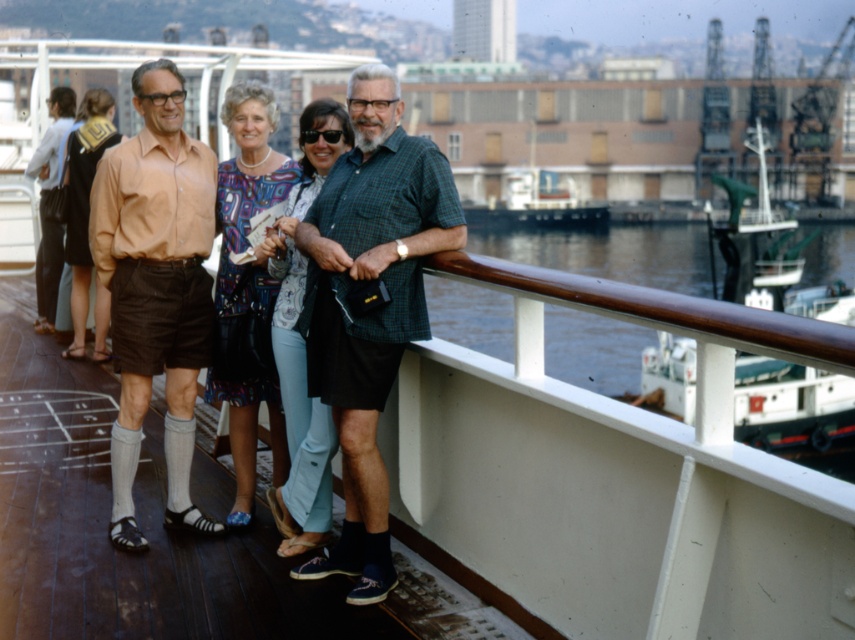
You are a photographer standing on the deck of a ship, and you want to take a photo of both the matte peach shirt at center and the matte brown dress at left. If your camera has a maximum focus range of 4 meters, will you be able to capture both subjects in the same frame without moving closer?

The distance between the matte peach shirt at center and the matte brown dress at left is 4.28 meters. Since the camera can only focus up to 4 meters, you won need to move closer to ensure both are in focus.

You are standing on the ship deck and want to hand a message to the person wearing the matte peach shirt at center without disturbing the person in the matte brown dress at left. How should you approach?

Since the matte peach shirt at center is in front of the matte brown dress at left, you can approach from behind the matte brown dress at left to reach the matte peach shirt at center without disturbing them.

You are a photographer trying to capture a photo of the matte blue jeans at center without including the brown wooden railing at upper right in the frame. Is this possible based on their positions?

The brown wooden railing at upper right is positioned under the matte blue jeans at center, so it is likely blocking part of the jeans. To avoid including the railing, you may need to adjust your angle or position to frame the jeans without the railing in the shot.